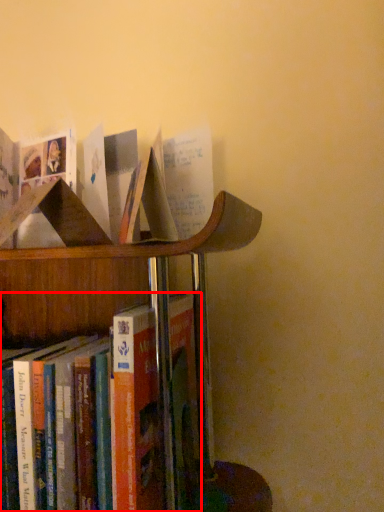
Question: From the image's perspective, where is book (annotated by the red box) located in relation to book in the image?

Choices:
 (A) above
 (B) below

Answer: (B)